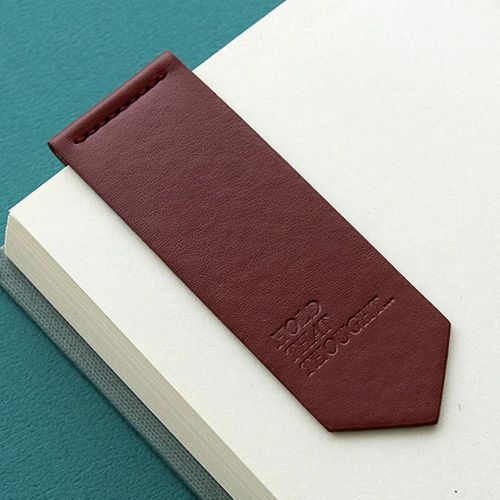
Locate an element on the screen. Image resolution: width=500 pixels, height=500 pixels. blue bindings of book is located at coordinates (109, 398).